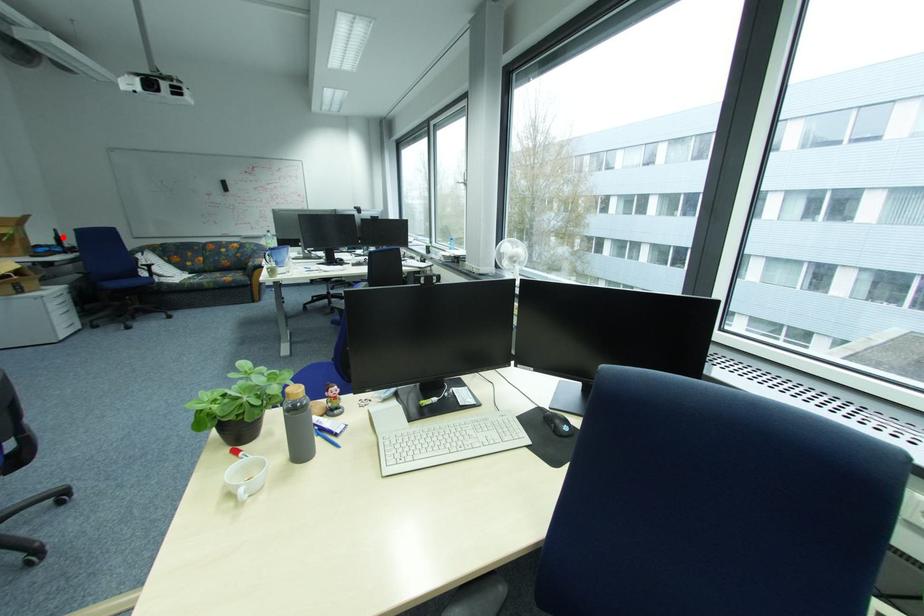
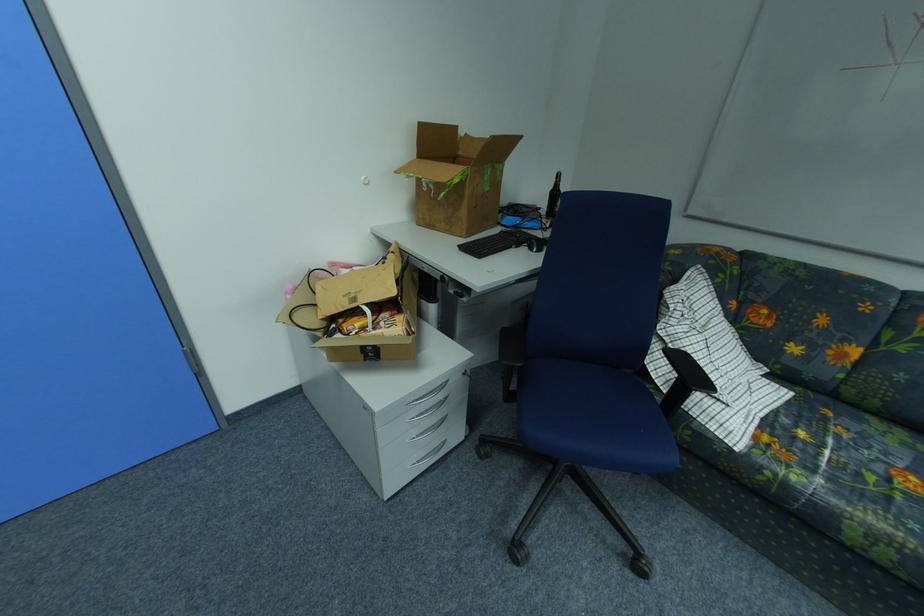
Locate, in the second image, the point that corresponds to the highlighted location in the first image.

(560, 188)